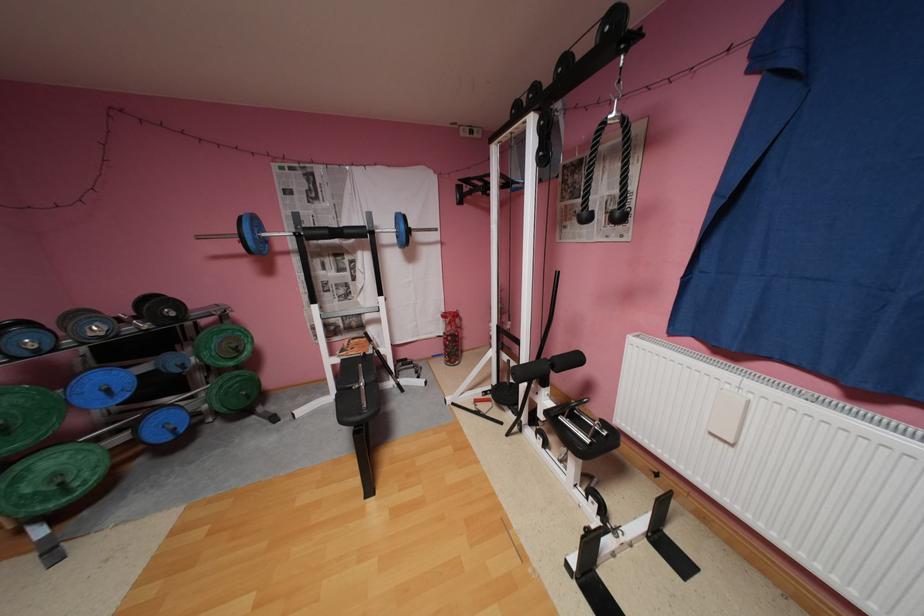
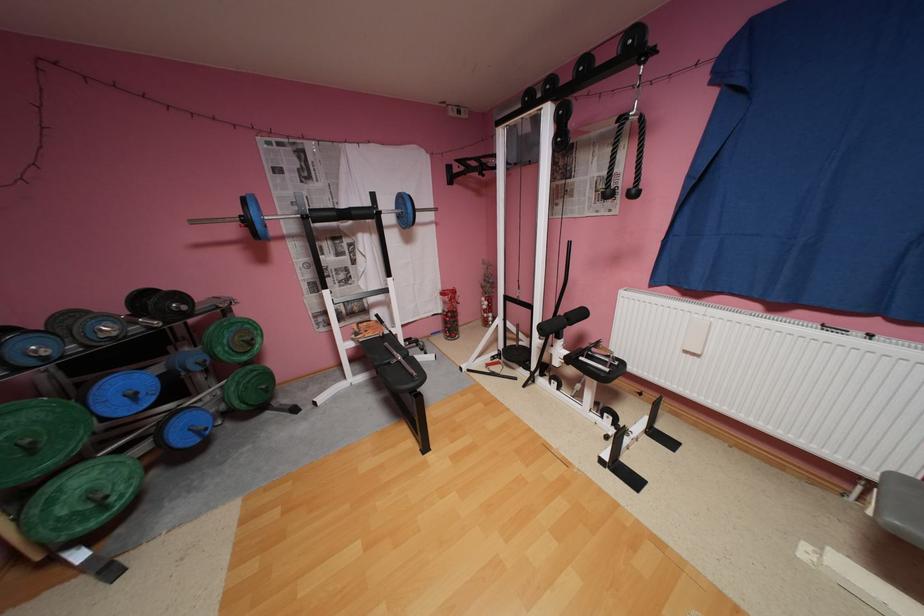
Question: The images are taken continuously from a first-person perspective. In which direction is your viewpoint rotating?

Choices:
 (A) Left
 (B) Right
 (C) Up
 (D) Down

Answer: (B)